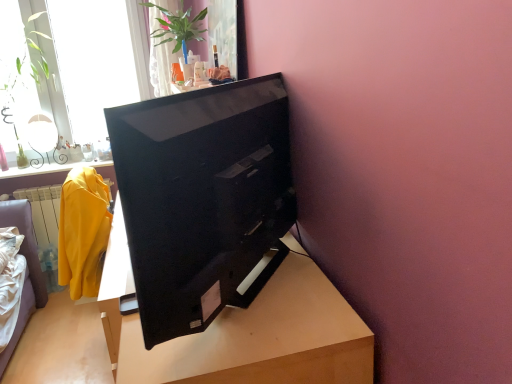
Where is `green glossy plant at upper center`? This screenshot has height=384, width=512. green glossy plant at upper center is located at coordinates (177, 27).

Measure the distance between point [334,332] and camera.

The distance of point [334,332] from camera is 32.48 inches.

Locate an element on the screen. transparent glass window at upper left is located at coordinates (137, 54).

The width and height of the screenshot is (512, 384). In order to click on green glossy plant at upper center in this screenshot , I will do `click(177, 27)`.

Locate an element on the screen. plant that appears below the transparent glass window at upper left (from the image's perspective) is located at coordinates (23, 83).

Is there a large distance between green leafy plant at upper left and transparent glass window at upper left?

No, green leafy plant at upper left is not far away from transparent glass window at upper left.

Does green leafy plant at upper left lie in front of transparent glass window at upper left?

Yes, it is.

Based on the photo, is green leafy plant at upper left wider than transparent glass window at upper left?

Correct, the width of green leafy plant at upper left exceeds that of transparent glass window at upper left.

Between black glossy television at center and green leafy plant at upper left, which one appears on the right side from the viewer's perspective?

Positioned to the right is black glossy television at center.

From their relative heights in the image, would you say black glossy television at center is taller or shorter than green leafy plant at upper left?

black glossy television at center is shorter than green leafy plant at upper left.

From the image's perspective, is black glossy television at center above or below green leafy plant at upper left?

black glossy television at center is below green leafy plant at upper left.

Considering the sizes of objects black glossy television at center and green leafy plant at upper left in the image provided, who is bigger, black glossy television at center or green leafy plant at upper left?

green leafy plant at upper left.

In the image, there is a black glossy television at center. Where is `table below it (from a real-world perspective)`? table below it (from a real-world perspective) is located at coordinates (242, 330).

Considering the positions of objects black glossy television at center and wooden table at center in the image provided, who is more to the left, black glossy television at center or wooden table at center?

From the viewer's perspective, wooden table at center appears more on the left side.

Can you tell me how much black glossy television at center and wooden table at center differ in facing direction?

The angle between the facing direction of black glossy television at center and the facing direction of wooden table at center is 38.7 degrees.

Is black glossy television at center facing away from wooden table at center?

No, wooden table at center is not at the back of black glossy television at center.

Locate an element on the screen. This screenshot has width=512, height=384. table that is on the right side of green glossy plant at upper center is located at coordinates (242, 330).

Are green glossy plant at upper center and wooden table at center making contact?

green glossy plant at upper center and wooden table at center are clearly separated.

From the image's perspective, which object appears higher, green glossy plant at upper center or wooden table at center?

green glossy plant at upper center is shown above in the image.

Which object is positioned more to the left, green glossy plant at upper center or wooden table at center?

green glossy plant at upper center is more to the left.

From the picture: Which is correct: black glossy television at center is inside green glossy plant at upper center, or outside of it?

black glossy television at center exists outside the volume of green glossy plant at upper center.

How far apart are black glossy television at center and green glossy plant at upper center?

A distance of 4.38 feet exists between black glossy television at center and green glossy plant at upper center.

Considering the sizes of objects black glossy television at center and green glossy plant at upper center in the image provided, who is smaller, black glossy television at center or green glossy plant at upper center?

black glossy television at center.

Which is in front, black glossy television at center or green glossy plant at upper center?

black glossy television at center is closer to the camera.

Which is behind, transparent glass window at upper left or green leafy plant at upper left?

transparent glass window at upper left is further from the camera.

Could you tell me if transparent glass window at upper left is turned towards green leafy plant at upper left?

Yes, transparent glass window at upper left is oriented towards green leafy plant at upper left.

Which of these two, transparent glass window at upper left or green leafy plant at upper left, is thinner?

Thinner between the two is transparent glass window at upper left.

From the image's perspective, is transparent glass window at upper left located above or below green leafy plant at upper left?

Clearly, from the image's perspective, transparent glass window at upper left is above green leafy plant at upper left.

From a real-world perspective, between green glossy plant at upper center and transparent glass window at upper left, who is vertically lower?

transparent glass window at upper left.

Is point (204, 9) behind point (125, 80)?

No, (204, 9) is in front of (125, 80).

Which is more to the left, green glossy plant at upper center or transparent glass window at upper left?

From the viewer's perspective, transparent glass window at upper left appears more on the left side.

In terms of width, does green glossy plant at upper center look wider or thinner when compared to transparent glass window at upper left?

Clearly, green glossy plant at upper center has more width compared to transparent glass window at upper left.

Find the location of `window located behind the green leafy plant at upper left`. window located behind the green leafy plant at upper left is located at coordinates (137, 54).

You are a GUI agent. You are given a task and a screenshot of the screen. Output one action in this format:
    pyautogui.click(x=<x>, y=<y>)
    Task: Click on the plant above the black glossy television at center (from a real-world perspective)
    This screenshot has height=384, width=512.
    Given the screenshot: What is the action you would take?
    pyautogui.click(x=23, y=83)

Which object lies nearer to the anchor point transparent glass window at upper left, green glossy plant at upper center or wooden table at center?

green glossy plant at upper center is positioned closer to the anchor transparent glass window at upper left.

Looking at the image, which one is located further to transparent glass window at upper left, green leafy plant at upper left or black glossy television at center?

Based on the image, black glossy television at center appears to be further to transparent glass window at upper left.

Based on their spatial positions, is transparent glass window at upper left or black glossy television at center further from green glossy plant at upper center?

Based on the image, black glossy television at center appears to be further to green glossy plant at upper center.

When comparing their distances from transparent glass window at upper left, does green glossy plant at upper center or green leafy plant at upper left seem further?

Among the two, green glossy plant at upper center is located further to transparent glass window at upper left.

Consider the image. Considering their positions, is green leafy plant at upper left positioned closer to transparent glass window at upper left than wooden table at center?

green leafy plant at upper left is positioned closer to the anchor transparent glass window at upper left.

Looking at the image, which one is located further to green leafy plant at upper left, black glossy television at center or green glossy plant at upper center?

black glossy television at center lies further to green leafy plant at upper left than the other object.

When comparing their distances from black glossy television at center, does wooden table at center or transparent glass window at upper left seem closer?

wooden table at center lies closer to black glossy television at center than the other object.

From the picture: Considering their positions, is wooden table at center positioned further to transparent glass window at upper left than green glossy plant at upper center?

wooden table at center is positioned further to the anchor transparent glass window at upper left.

Where is `table between black glossy television at center and transparent glass window at upper left along the z-axis`? table between black glossy television at center and transparent glass window at upper left along the z-axis is located at coordinates (242, 330).

I want to click on plant between black glossy television at center and transparent glass window at upper left along the z-axis, so click(x=23, y=83).

Where is `plant located between wooden table at center and transparent glass window at upper left in the depth direction`? Image resolution: width=512 pixels, height=384 pixels. plant located between wooden table at center and transparent glass window at upper left in the depth direction is located at coordinates (23, 83).

Locate an element on the screen. This screenshot has height=384, width=512. houseplant between black glossy television at center and green leafy plant at upper left along the z-axis is located at coordinates pyautogui.click(x=177, y=27).